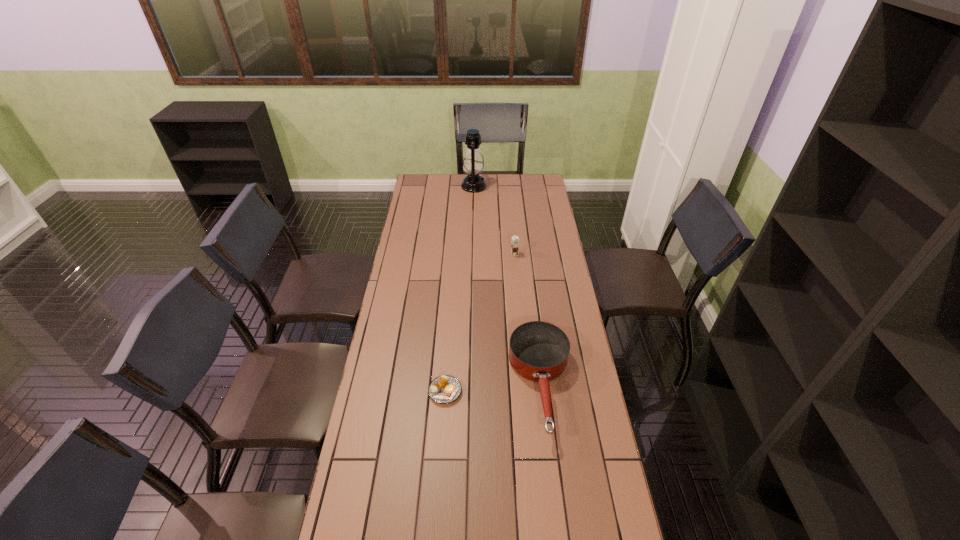
Image resolution: width=960 pixels, height=540 pixels. Find the location of `vacant region that satisfies the following two spatial constraints: 1. on the front side of the third nearest object; 2. on the right side of the farthest object`. vacant region that satisfies the following two spatial constraints: 1. on the front side of the third nearest object; 2. on the right side of the farthest object is located at coordinates (472, 254).